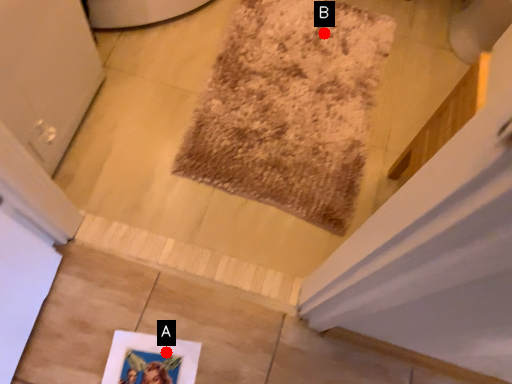
Question: Two points are circled on the image, labeled by A and B beside each circle. Which point appears closest to the camera in this image?

Choices:
 (A) A is closer
 (B) B is closer

Answer: (A)